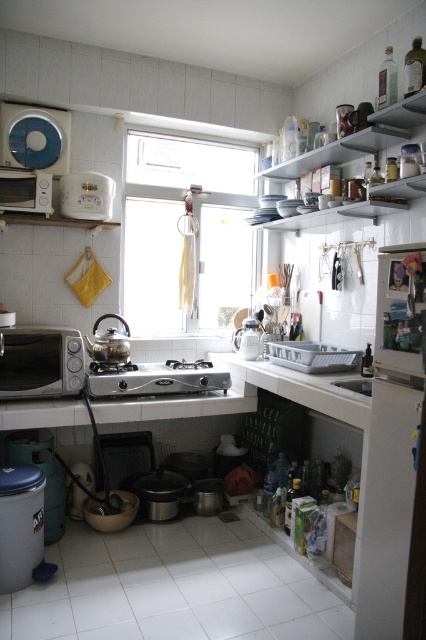
You are a chef preparing to hang a pot rack in the kitchen. You need to choose between placing it above the transparent glass window at center or above the silver metallic stove at center. Which location has enough vertical space to accommodate the pot rack without touching the ceiling?

The transparent glass window at center is much taller than the silver metallic stove at center, so placing the pot rack above the transparent glass window at center would provide sufficient vertical space to avoid touching the ceiling.

You are a delivery person who needs to place a package on the counter between the metallic silver dishes at upper right and the white glossy sink at lower center. The package is 1 meter long. Will it fit?

The distance between the metallic silver dishes at upper right and the white glossy sink at lower center is 1.22 meters. Since the package is 1 meter long, it will fit comfortably within the space.